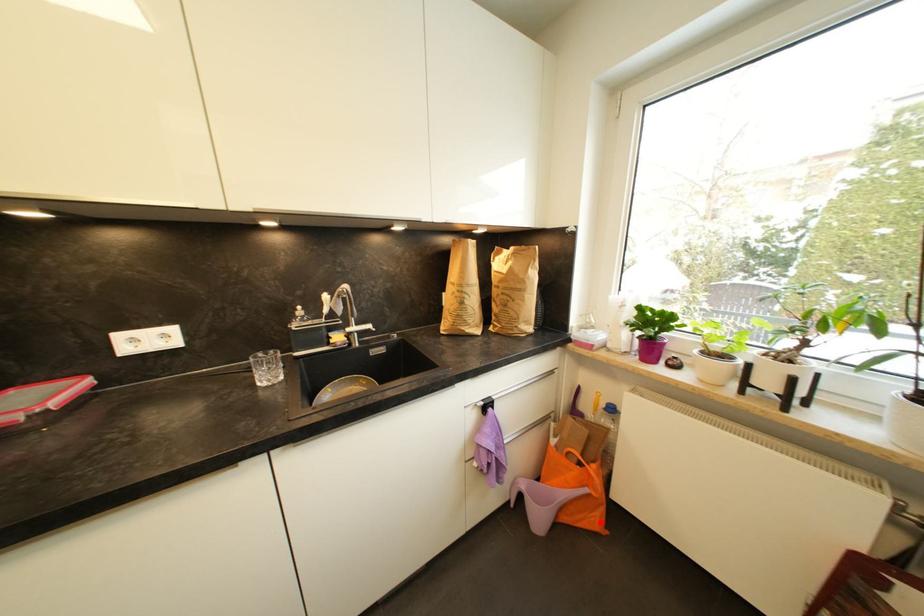
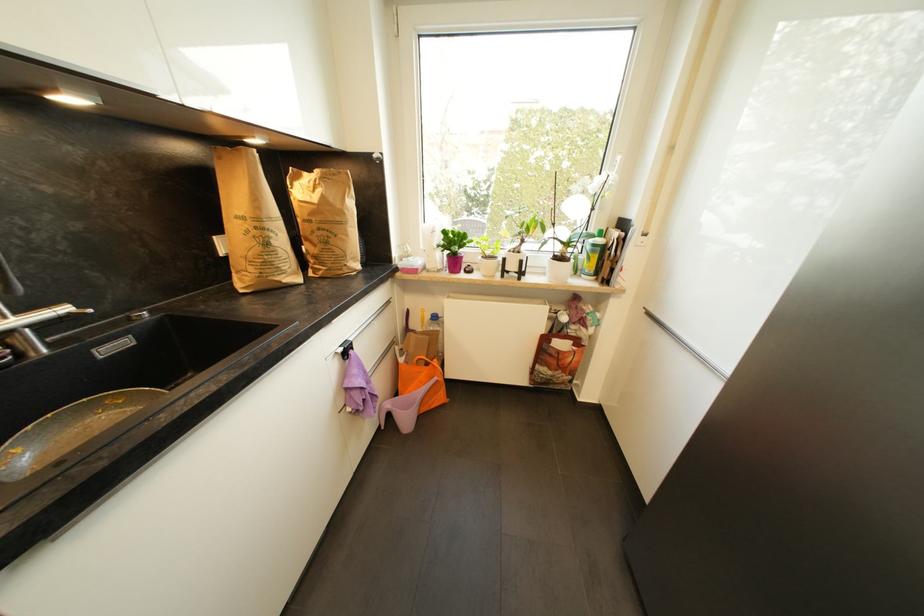
Question: A red point is marked in image1. In image2, is the corresponding 3D point closer to the camera or farther? Reply with the corresponding letter.

Choices:
 (A) The corresponding 3D point is closer.
 (B) The corresponding 3D point is farther.

Answer: (A)